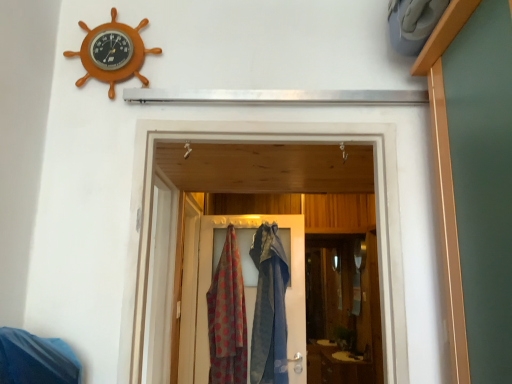
Question: In terms of height, does orange wooden ship wheel at upper left look taller or shorter compared to textured fabric door at center?

Choices:
 (A) tall
 (B) short

Answer: (B)

Question: From the image's perspective, relative to textured fabric door at center, is orange wooden ship wheel at upper left above or below?

Choices:
 (A) below
 (B) above

Answer: (B)

Question: Which object is positioned closest to the polka dot fabric scarf at center?

Choices:
 (A) orange wooden ship wheel at upper left
 (B) textured fabric door at center

Answer: (B)

Question: Which object is the closest to the orange wooden ship wheel at upper left?

Choices:
 (A) polka dot fabric scarf at center
 (B) textured fabric door at center

Answer: (A)